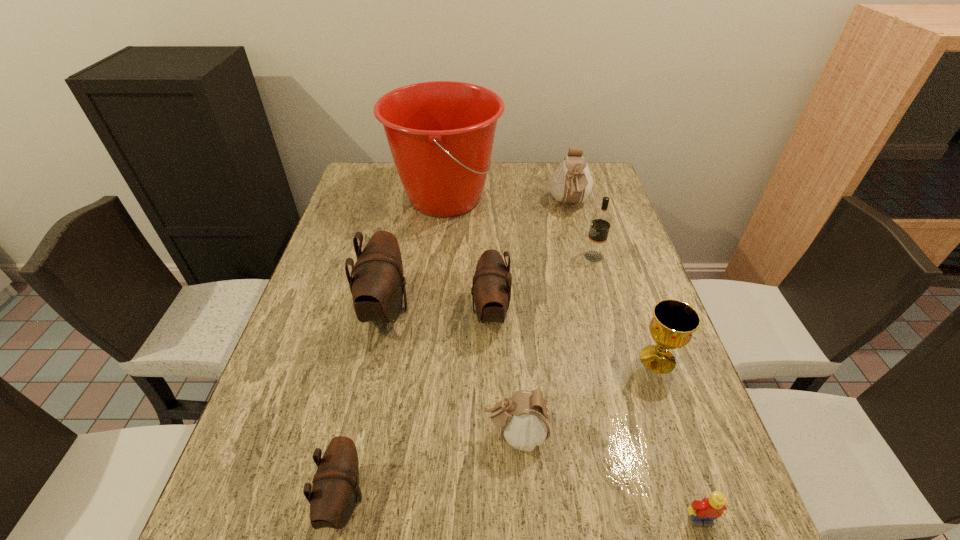
This screenshot has width=960, height=540. In order to click on vacant space located with the flap open on the second biggest brown pouch in this screenshot , I will do `click(447, 312)`.

At what (x,y) coordinates should I click in order to perform the action: click on free space located 0.390m on the left of the chalice. Please return your answer as a coordinate pair (x, y). Image resolution: width=960 pixels, height=540 pixels. Looking at the image, I should click on (463, 359).

Locate an element on the screen. free region located on the front-facing side of the seventh farthest object is located at coordinates (387, 434).

I want to click on vacant space situated 0.330m on the front-facing side of the seventh farthest object, so click(315, 434).

Find the location of a particular element. This screenshot has width=960, height=540. vacant space located on the front-facing side of the seventh farthest object is located at coordinates (459, 434).

Where is `bucket present at the far edge`? This screenshot has width=960, height=540. bucket present at the far edge is located at coordinates (441, 133).

Locate an element on the screen. This screenshot has width=960, height=540. pouch at the far edge is located at coordinates [x=571, y=182].

Locate an element on the screen. bucket that is at the left edge is located at coordinates (441, 133).

Find the location of a particular element. This screenshot has height=540, width=960. pouch located in the left edge section of the desktop is located at coordinates (378, 284).

In order to click on vodka that is at the right edge in this screenshot , I will do `click(594, 251)`.